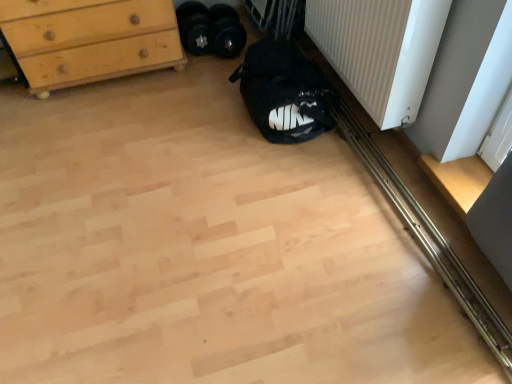
Question: Considering the positions of black rubber weights at center, marked as the 2th footwear in a right-to-left arrangement, and black fabric sleeping bag at lower center in the image, is black rubber weights at center, marked as the 2th footwear in a right-to-left arrangement, taller or shorter than black fabric sleeping bag at lower center?

Choices:
 (A) tall
 (B) short

Answer: (B)

Question: Is point (202, 26) positioned closer to the camera than point (245, 82)?

Choices:
 (A) farther
 (B) closer

Answer: (A)

Question: Based on their relative distances, which object is nearer to the white ribbed radiator at lower right?

Choices:
 (A) light wood chest of drawers at upper left
 (B) black fabric sleeping bag at lower center
 (C) black fabric shoe at center, which appears as the 1th footwear when viewed from the right
 (D) black rubber weights at center, positioned as the first footwear in left-to-right order

Answer: (B)

Question: Estimate the real-world distances between objects in this image. Which object is closer to the white ribbed radiator at lower right?

Choices:
 (A) black fabric sleeping bag at lower center
 (B) black fabric shoe at center, which appears as the 2th footwear when viewed from the left
 (C) light wood chest of drawers at upper left
 (D) black rubber weights at center, positioned as the first footwear in left-to-right order

Answer: (A)